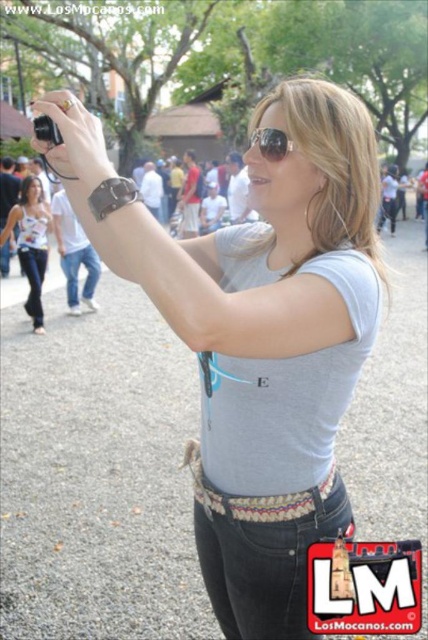
You are a fashion designer observing the woman in the scene. You need to determine the spatial arrangement of her clothing items. Based on the image, is the white printed tank top at center positioned higher or lower than the denim jeans at lower left?

The white printed tank top at center is above denim jeans at lower left, so it is positioned higher than the denim jeans at lower left.

You are a photographer trying to capture a candid shot of the woman in the scene. You need to ensure that both the matte black camera at upper left and the denim jeans at center are in focus. Given that your camera has a depth of field range of 3 meters, will you be able to achieve this?

The matte black camera at upper left and denim jeans at center are 3.35 meters apart. Since the depth of field range is only 3 meters, the distance between them exceeds this limit, making it impossible to have both in focus simultaneously.